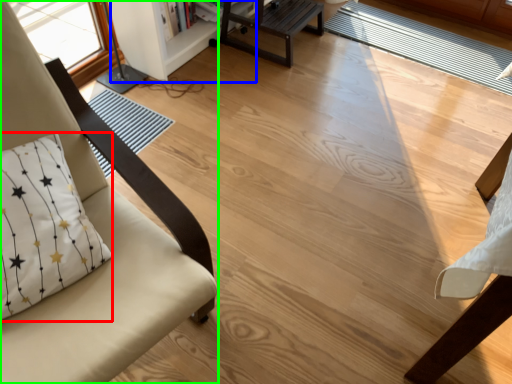
Question: Which is nearer to the pillow (highlighted by a red box)? bookshelf (highlighted by a blue box) or chair (highlighted by a green box).

Choices:
 (A) bookshelf
 (B) chair

Answer: (B)